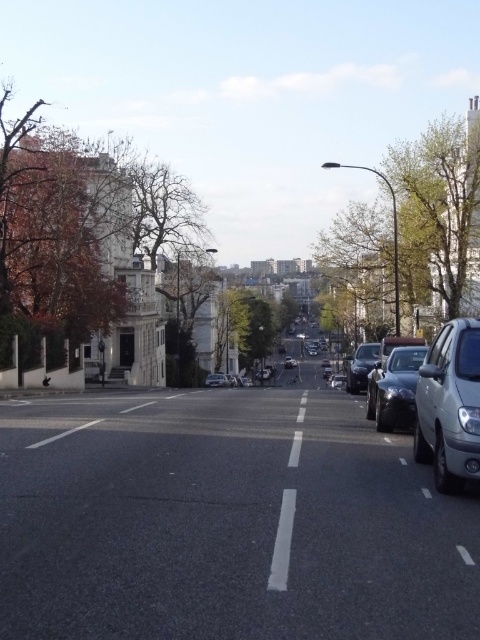
Can you confirm if green leafy tree at right is positioned to the left of satin black car at center?

No, green leafy tree at right is not to the left of satin black car at center.

Describe the element at coordinates (434, 211) in the screenshot. I see `green leafy tree at right` at that location.

Locate an element on the screen. This screenshot has width=480, height=640. green leafy tree at right is located at coordinates (434, 211).

In order to click on green leafy tree at right in this screenshot , I will do `click(434, 211)`.

Who is more forward, (423, 355) or (228, 320)?

Point (423, 355) is in front.

Which is above, satin black sedan at right or green leafy tree at center?

Positioned higher is green leafy tree at center.

The width and height of the screenshot is (480, 640). Identify the location of satin black sedan at right. (395, 388).

Where is `satin black sedan at right`? Image resolution: width=480 pixels, height=640 pixels. satin black sedan at right is located at coordinates (395, 388).

Who is more forward, (437, 342) or (230, 291)?

Positioned in front is point (437, 342).

Can you confirm if satin silver car at right is positioned below green leafy tree at center?

Correct, satin silver car at right is located below green leafy tree at center.

Between point (428, 456) and point (236, 348), which one is positioned behind?

Point (236, 348)

Identify the location of satin silver car at right. (450, 406).